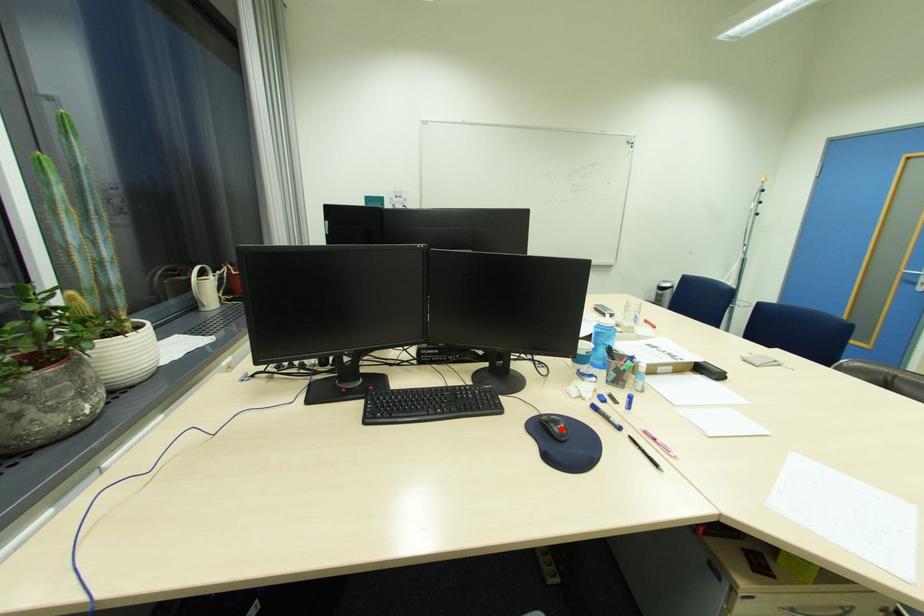
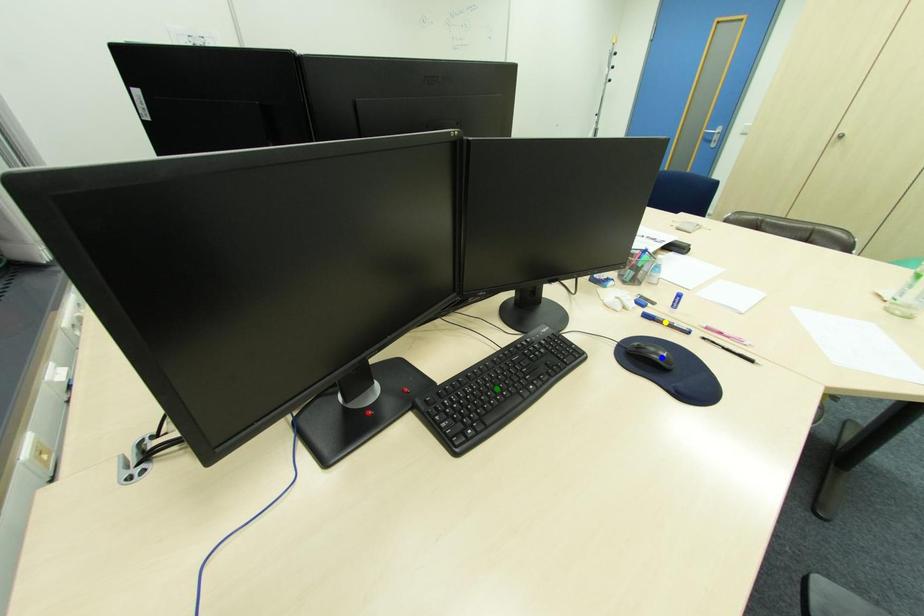
Question: I am providing you with two images of the same scene from different viewpoints. A red point is marked on the first image. You are given multiple points on the second image. Which point in image 2 represents the same 3d spot as the red point in image 1?

Choices:
 (A) blue point
 (B) yellow point
 (C) green point

Answer: (A)